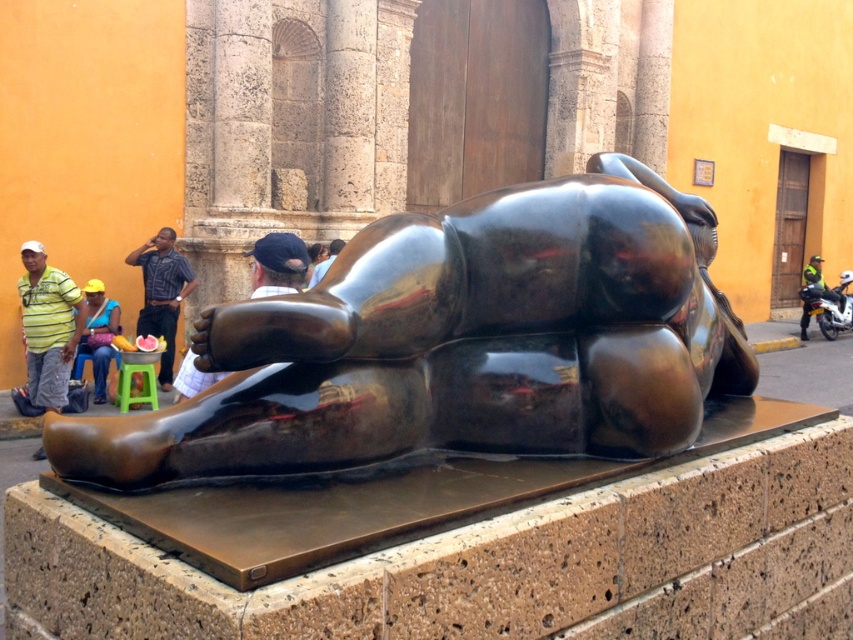
Question: Which point is farther to the camera?

Choices:
 (A) click(x=682, y=337)
 (B) click(x=20, y=252)
 (C) click(x=181, y=257)

Answer: (C)

Question: Which of these objects is positioned farthest from the matte black shirt at center?

Choices:
 (A) matte black cap at center
 (B) glossy bronze bear at center
 (C) yellow-green striped shirt at left
 (D) blue plaid shirt at center

Answer: (B)

Question: Does blue plaid shirt at center have a greater width compared to matte black shirt at center?

Choices:
 (A) no
 (B) yes

Answer: (B)

Question: Which of these objects is positioned farthest from the matte black cap at center?

Choices:
 (A) yellow-green striped shirt at left
 (B) shiny black motorcycle at right

Answer: (B)

Question: Does glossy bronze bear at center have a smaller size compared to matte black shirt at center?

Choices:
 (A) no
 (B) yes

Answer: (A)

Question: Is the position of blue plaid shirt at center more distant than that of matte yellow hat at center?

Choices:
 (A) yes
 (B) no

Answer: (A)